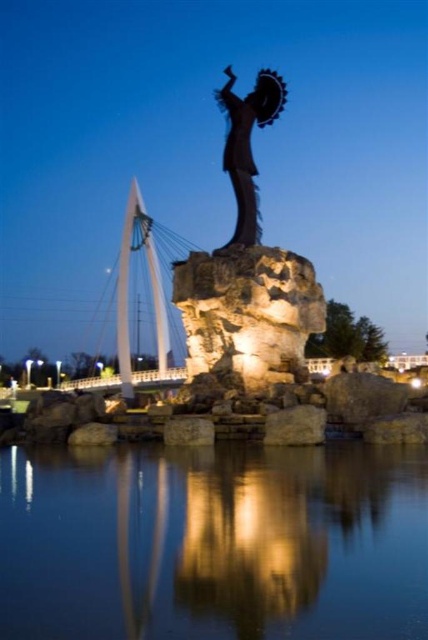
Between transparent glass water at center and shiny bronze statue at center, which one is positioned higher?

shiny bronze statue at center

Does point (155, 584) lie in front of point (282, 276)?

That is True.

Which is behind, point (427, 477) or point (223, 340)?

Positioned behind is point (223, 340).

Find the location of a particular element. This screenshot has height=640, width=428. transparent glass water at center is located at coordinates (214, 544).

Does shiny bronze statue at center appear over smooth gray rock at center?

Indeed, shiny bronze statue at center is positioned over smooth gray rock at center.

Does shiny bronze statue at center have a lesser width compared to smooth gray rock at center?

No.

Does point (288, 362) come in front of point (205, 426)?

No.

Where is `shiny bronze statue at center`? The image size is (428, 640). shiny bronze statue at center is located at coordinates (247, 269).

Which is more to the right, transparent glass water at center or black metal statue at center?

From the viewer's perspective, black metal statue at center appears more on the right side.

Which is in front, point (155, 620) or point (249, 218)?

Point (155, 620) is in front.

Find the location of a particular element. transparent glass water at center is located at coordinates (214, 544).